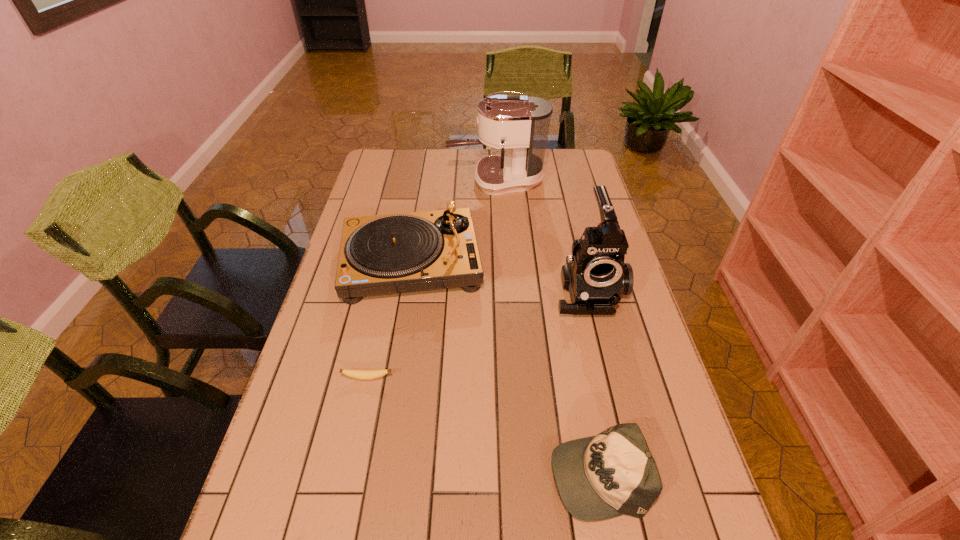
The image size is (960, 540). I want to click on the farthest object, so click(x=521, y=123).

Identify the location of camcorder. The height and width of the screenshot is (540, 960). click(x=595, y=275).

The width and height of the screenshot is (960, 540). In order to click on record player in this screenshot , I will do `click(393, 253)`.

This screenshot has height=540, width=960. In order to click on baseball cap in this screenshot , I will do pos(613,473).

Where is `the fourth tallest object`? The height and width of the screenshot is (540, 960). the fourth tallest object is located at coordinates (613, 473).

Find the location of a particular element. The width and height of the screenshot is (960, 540). banana is located at coordinates (353, 373).

This screenshot has height=540, width=960. What are the coordinates of `the fourth farthest object` in the screenshot? It's located at (353, 373).

Where is `vacant space located on the front-facing side of the coffee maker`? vacant space located on the front-facing side of the coffee maker is located at coordinates (404, 181).

You are a GUI agent. You are given a task and a screenshot of the screen. Output one action in this format:
    pyautogui.click(x=<x>, y=<y>)
    Task: Click on the vacant space located on the front-facing side of the coffee maker
    The height and width of the screenshot is (540, 960).
    Given the screenshot: What is the action you would take?
    pyautogui.click(x=430, y=181)

You are a GUI agent. You are given a task and a screenshot of the screen. Output one action in this format:
    pyautogui.click(x=<x>, y=<y>)
    Task: Click on the free space located on the front-facing side of the coffee maker
    Image resolution: width=960 pixels, height=540 pixels.
    Given the screenshot: What is the action you would take?
    pyautogui.click(x=412, y=181)